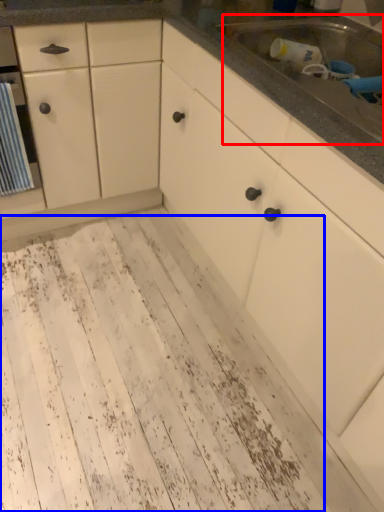
Question: Which object appears farthest to the camera in this image, sink (highlighted by a red box) or mud (highlighted by a blue box)?

Choices:
 (A) sink
 (B) mud

Answer: (B)